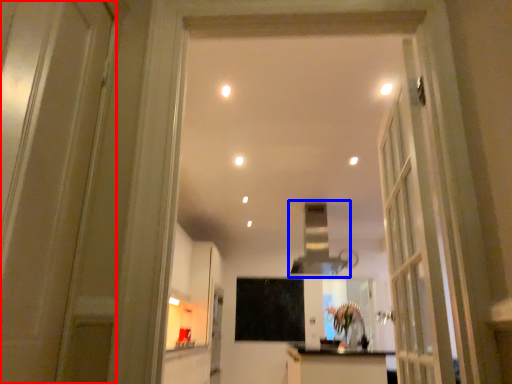
Question: Which of the following is the farthest to the observer, door (highlighted by a red box) or exhaust hood (highlighted by a blue box)?

Choices:
 (A) door
 (B) exhaust hood

Answer: (B)